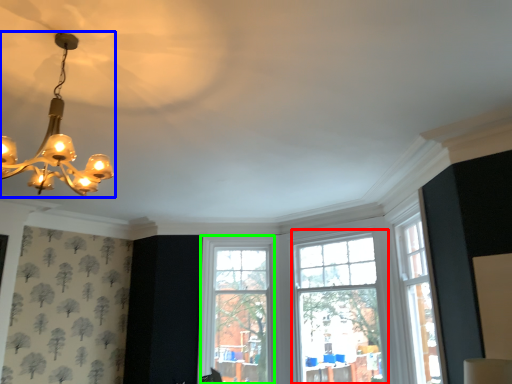
Question: Based on their relative distances, which object is farther from window (highlighted by a red box)? Choose from lamp (highlighted by a blue box) and window (highlighted by a green box).

Choices:
 (A) lamp
 (B) window

Answer: (A)